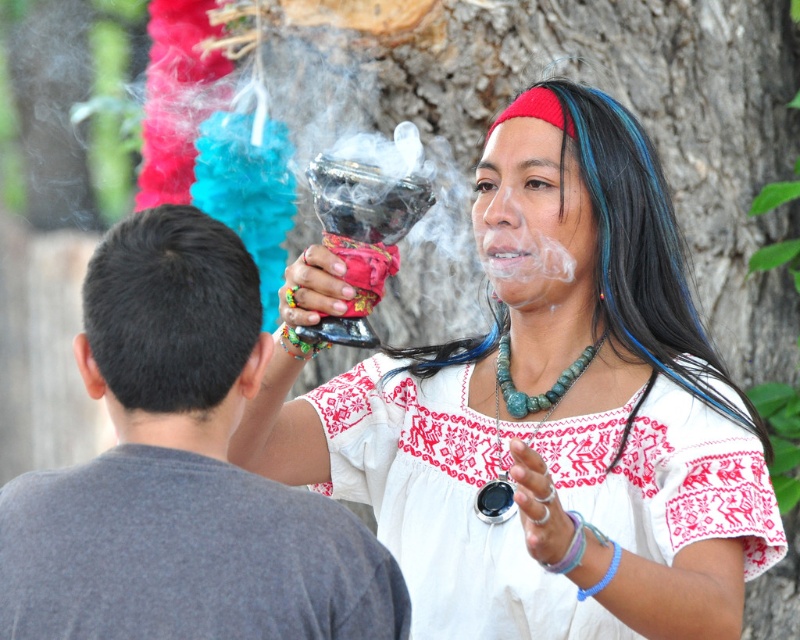
Which is more to the left, gray cotton shirt at upper left or white embroidered dress at center?

gray cotton shirt at upper left is more to the left.

The height and width of the screenshot is (640, 800). I want to click on gray cotton shirt at upper left, so click(x=182, y=472).

Is gray cotton shirt at upper left below turquoise stone necklace at center?

Indeed, gray cotton shirt at upper left is positioned under turquoise stone necklace at center.

Between gray cotton shirt at upper left and turquoise stone necklace at center, which one has less height?

turquoise stone necklace at center

Describe the element at coordinates (182, 472) in the screenshot. I see `gray cotton shirt at upper left` at that location.

At what (x,y) coordinates should I click in order to perform the action: click on gray cotton shirt at upper left. Please return your answer as a coordinate pair (x, y). Looking at the image, I should click on (182, 472).

Does point (524, 157) come in front of point (558, 394)?

Yes, point (524, 157) is in front of point (558, 394).

Locate an element on the screen. matte black bowl at upper center is located at coordinates (544, 410).